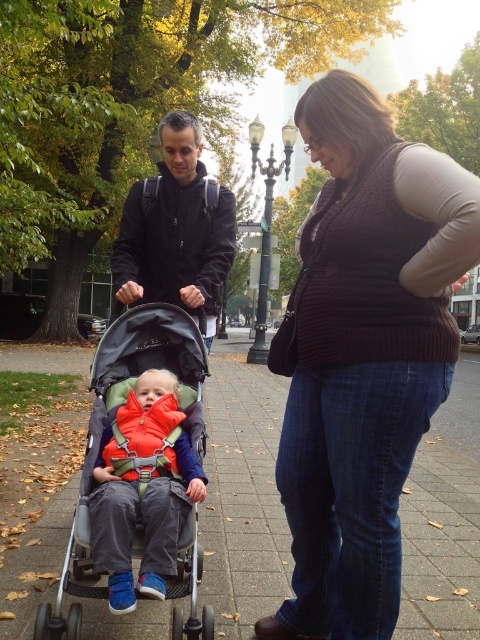
Question: Is knit sweater at center to the right of matte black jacket at center from the viewer's perspective?

Choices:
 (A) no
 (B) yes

Answer: (B)

Question: Can you confirm if gray concrete pavement at center is positioned to the right of silver metallic stroller at center?

Choices:
 (A) no
 (B) yes

Answer: (B)

Question: Estimate the real-world distances between objects in this image. Which object is farther from the matte orange jacket at center?

Choices:
 (A) knit sweater at center
 (B) silver metallic stroller at center
 (C) gray concrete pavement at center

Answer: (C)

Question: Which point appears farthest from the camera in this image?

Choices:
 (A) (128, 624)
 (B) (87, 452)
 (C) (204, 193)

Answer: (C)

Question: From the image, what is the correct spatial relationship of knit sweater at center in relation to gray concrete pavement at center?

Choices:
 (A) below
 (B) above

Answer: (B)

Question: Among these objects, which one is farthest from the camera?

Choices:
 (A) silver metallic stroller at center
 (B) matte orange jacket at center
 (C) gray concrete pavement at center
 (D) knit sweater at center

Answer: (C)